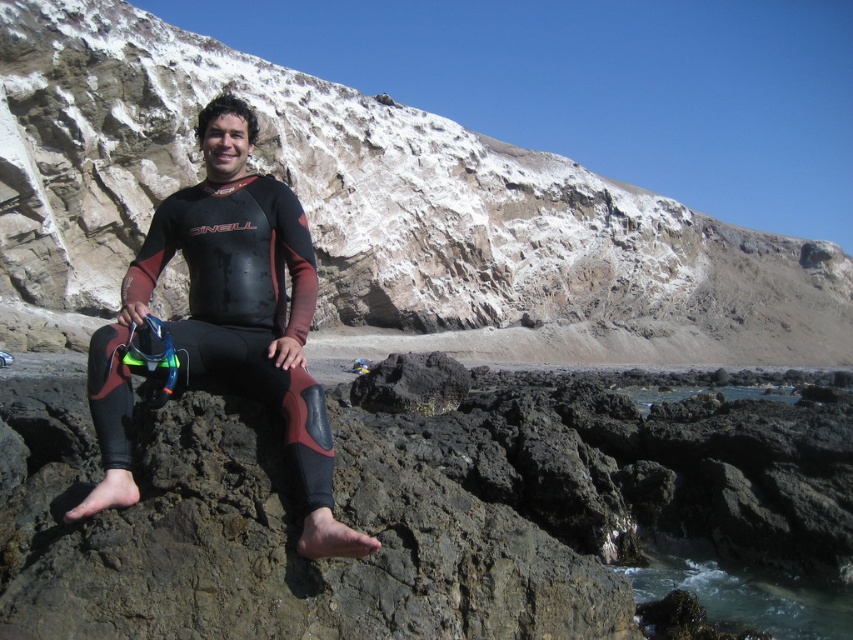
Consider the image. Is rugged stone cliff at center below clear water at lower right?

Answer: No, rugged stone cliff at center is not below clear water at lower right.

Is rugged stone cliff at center to the right of clear water at lower right from the viewer's perspective?

Yes, rugged stone cliff at center is to the right of clear water at lower right.

Locate an element on the screen. The image size is (853, 640). rugged stone cliff at center is located at coordinates (375, 212).

Between rugged stone cliff at center and black matte wetsuit at center, which one appears on the left side from the viewer's perspective?

Positioned to the left is black matte wetsuit at center.

Which is in front, point (161, 180) or point (229, 202)?

Point (229, 202) is in front.

At what (x,y) coordinates should I click in order to perform the action: click on rugged stone cliff at center. Please return your answer as a coordinate pair (x, y). This screenshot has width=853, height=640. Looking at the image, I should click on (375, 212).

Is black matte wetsuit at center below clear water at lower right?

No.

Does black matte wetsuit at center appear on the left side of clear water at lower right?

Yes, black matte wetsuit at center is to the left of clear water at lower right.

Describe the element at coordinates (227, 320) in the screenshot. I see `black matte wetsuit at center` at that location.

Identify the location of black matte wetsuit at center. Image resolution: width=853 pixels, height=640 pixels. (227, 320).